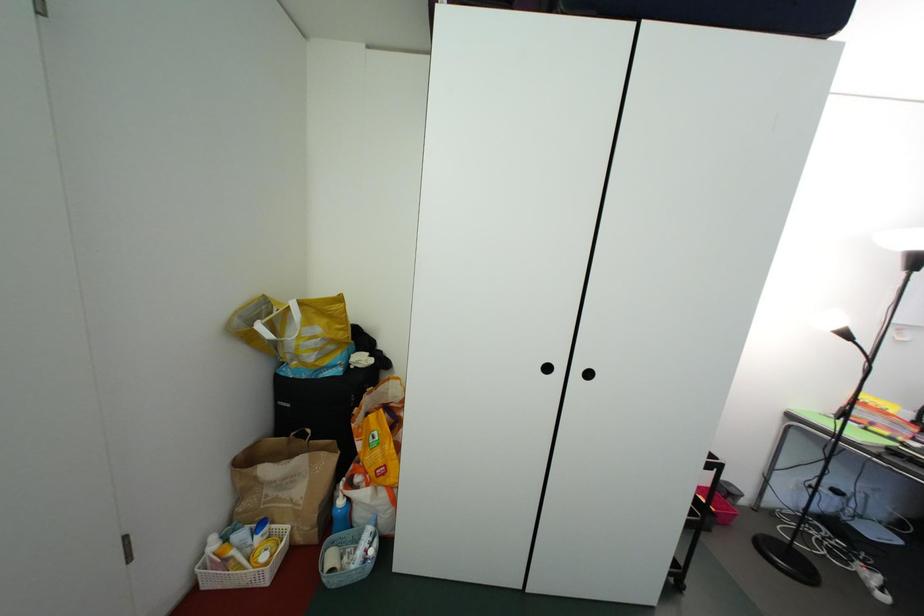
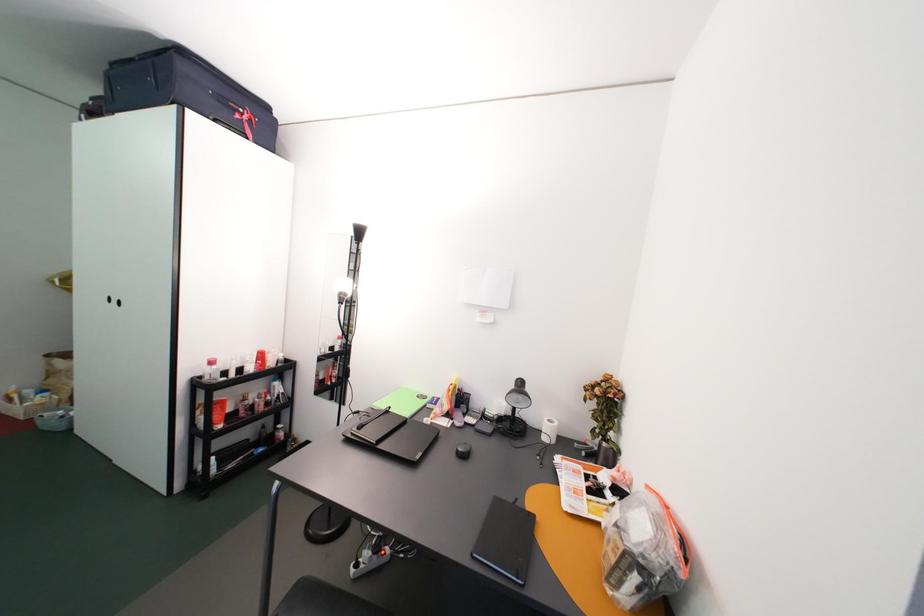
Question: The images are taken continuously from a first-person perspective. In which direction are you moving?

Choices:
 (A) Left
 (B) Right
 (C) Forward
 (D) Backward

Answer: (B)